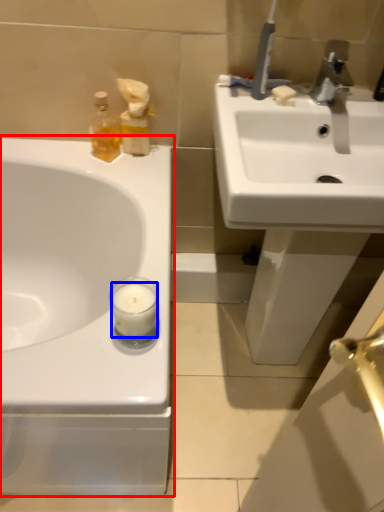
Question: Among these objects, which one is nearest to the camera, sink (highlighted by a red box) or candle (highlighted by a blue box)?

Choices:
 (A) sink
 (B) candle

Answer: (A)